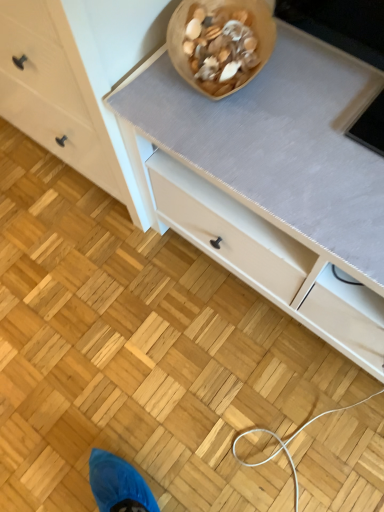
Question: Is white matte chest of drawers at lower left thinner than wooden bowl at upper center?

Choices:
 (A) yes
 (B) no

Answer: (B)

Question: Could you tell me if white matte chest of drawers at lower left is turned towards wooden bowl at upper center?

Choices:
 (A) no
 (B) yes

Answer: (A)

Question: From the image's perspective, is white matte chest of drawers at lower left below wooden bowl at upper center?

Choices:
 (A) no
 (B) yes

Answer: (A)

Question: Is white matte chest of drawers at lower left positioned in front of wooden bowl at upper center?

Choices:
 (A) yes
 (B) no

Answer: (A)

Question: Is white matte chest of drawers at lower left positioned behind wooden bowl at upper center?

Choices:
 (A) no
 (B) yes

Answer: (A)

Question: Is white matte chest of drawers at lower left at the left side of wooden bowl at upper center?

Choices:
 (A) yes
 (B) no

Answer: (A)

Question: Considering the relative sizes of wooden bowl at upper center and white matte chest of drawers at lower left in the image provided, is wooden bowl at upper center bigger than white matte chest of drawers at lower left?

Choices:
 (A) yes
 (B) no

Answer: (B)

Question: Does wooden bowl at upper center have a greater width compared to white matte chest of drawers at lower left?

Choices:
 (A) no
 (B) yes

Answer: (A)

Question: From a real-world perspective, is wooden bowl at upper center over white matte chest of drawers at lower left?

Choices:
 (A) no
 (B) yes

Answer: (B)

Question: Is wooden bowl at upper center turned away from white matte chest of drawers at lower left?

Choices:
 (A) no
 (B) yes

Answer: (B)

Question: Is wooden bowl at upper center smaller than white matte chest of drawers at lower left?

Choices:
 (A) yes
 (B) no

Answer: (A)

Question: From the image's perspective, is wooden bowl at upper center on white matte chest of drawers at lower left?

Choices:
 (A) yes
 (B) no

Answer: (B)

Question: From a real-world perspective, is wooden bowl at upper center above or below white matte chest of drawers at lower left?

Choices:
 (A) above
 (B) below

Answer: (A)